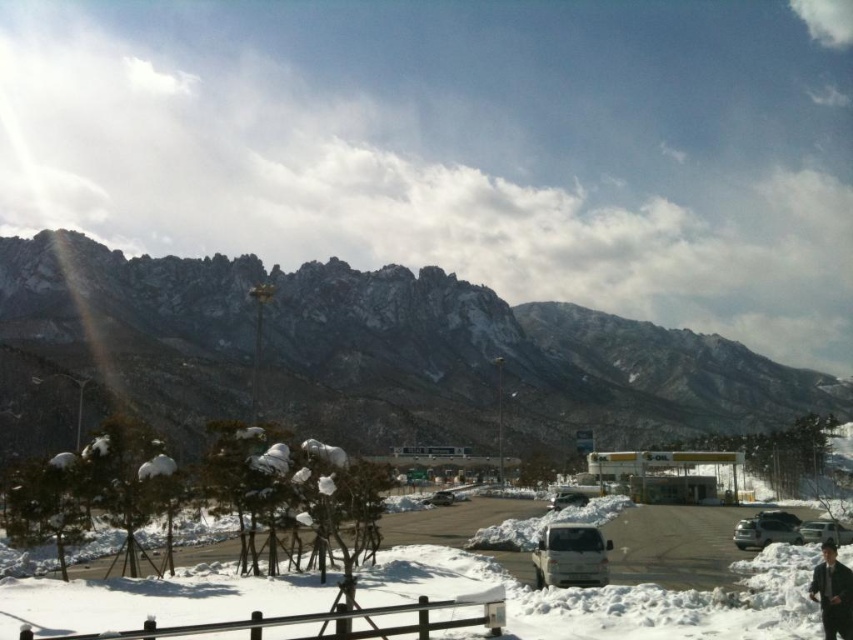
You are planning to take a photo of the rocky gray mountain at upper left and the white matte van at center. Which object should you focus on first if you want to capture both in a single shot without moving the camera?

The rocky gray mountain at upper left is larger in size compared to the white matte van at center, so you should focus on the larger rocky gray mountain at upper left first to ensure it fits properly in the frame before adjusting for the smaller white matte van at center.

You are standing at the wooden fence in the winter scene. You see the dark blue leather jacket at lower right and the sleek silver sedan at center. Which object is shorter in height?

The dark blue leather jacket at lower right has a lesser height compared to the sleek silver sedan at center, so the dark blue leather jacket at lower right is shorter.

You are standing at the point marked by the coordinate point at point [807,538]. You want to walk to the gas station. Which direction should you walk to reach the gas station?

The gas station is 105.19 meters away from the point at point [807,538]. Since the gas station is in the midground and the point is at the lower right corner, you should walk towards the center of the image to reach the gas station.